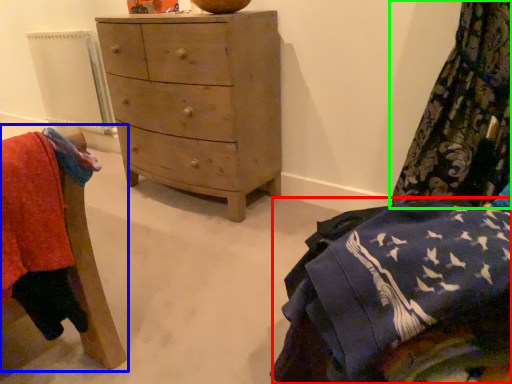
Question: Which object is the farthest from clothing (highlighted by a red box)? Choose among these: furniture (highlighted by a blue box) or curtain (highlighted by a green box).

Choices:
 (A) furniture
 (B) curtain

Answer: (B)